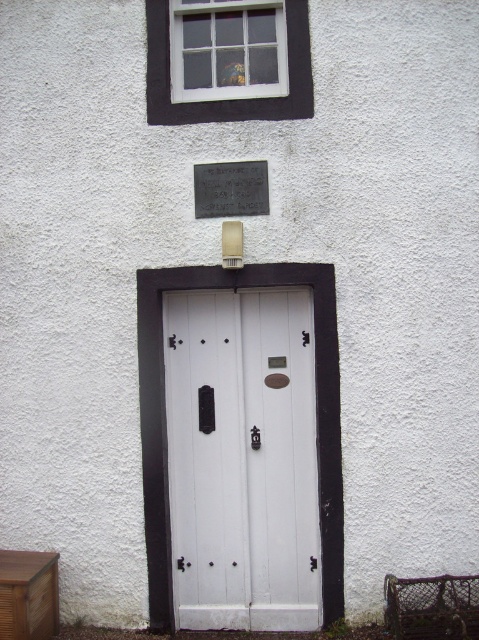
Does white wooden door at center have a greater width compared to metallic plaque at upper center?

Yes.

Who is more forward, [267,394] or [224,172]?

Point [224,172]

Is point (278, 624) behind point (258, 172)?

Yes, point (278, 624) is behind point (258, 172).

Locate an element on the screen. white wooden door at center is located at coordinates (241, 460).

Can you confirm if white wooden door at center is taller than wooden drawer at lower left?

Yes, white wooden door at center is taller than wooden drawer at lower left.

What do you see at coordinates (241, 460) in the screenshot?
I see `white wooden door at center` at bounding box center [241, 460].

Where is `white wooden door at center`? This screenshot has width=479, height=640. white wooden door at center is located at coordinates click(241, 460).

Does white wooden door at center have a smaller size compared to white wooden window at upper center?

No.

Can you confirm if white wooden door at center is positioned above white wooden window at upper center?

Incorrect, white wooden door at center is not positioned above white wooden window at upper center.

Is point (202, 321) behind point (228, 72)?

Yes.

Where is `white wooden door at center`? white wooden door at center is located at coordinates (241, 460).